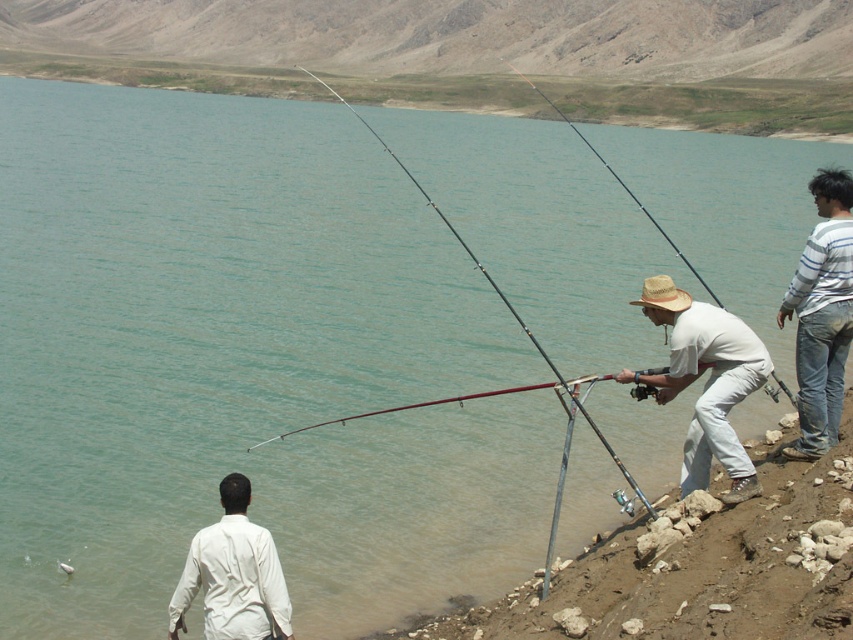
Question: Can you confirm if metallic fishing rod at lower right is smaller than white cotton shirt at center?

Choices:
 (A) no
 (B) yes

Answer: (A)

Question: In this image, where is striped shirt at right located relative to silvery metallic fish at lower left?

Choices:
 (A) above
 (B) below

Answer: (A)

Question: Which object is farther from the camera taking this photo?

Choices:
 (A) black rod fishing pole at center
 (B) metallic fishing rod at lower right
 (C) white matte shirt at lower left
 (D) white cotton shirt at center

Answer: (A)

Question: Which point appears farthest from the camera in this image?

Choices:
 (A) (407, 172)
 (B) (601, 582)
 (C) (62, 572)

Answer: (A)

Question: Which of these objects is positioned farthest from the white matte shirt at lower left?

Choices:
 (A) silvery metallic fish at lower left
 (B) black rod fishing pole at center
 (C) striped shirt at right
 (D) metallic rod at center

Answer: (B)

Question: Can you confirm if white cotton shirt at center is positioned above metallic rod at center?

Choices:
 (A) no
 (B) yes

Answer: (A)